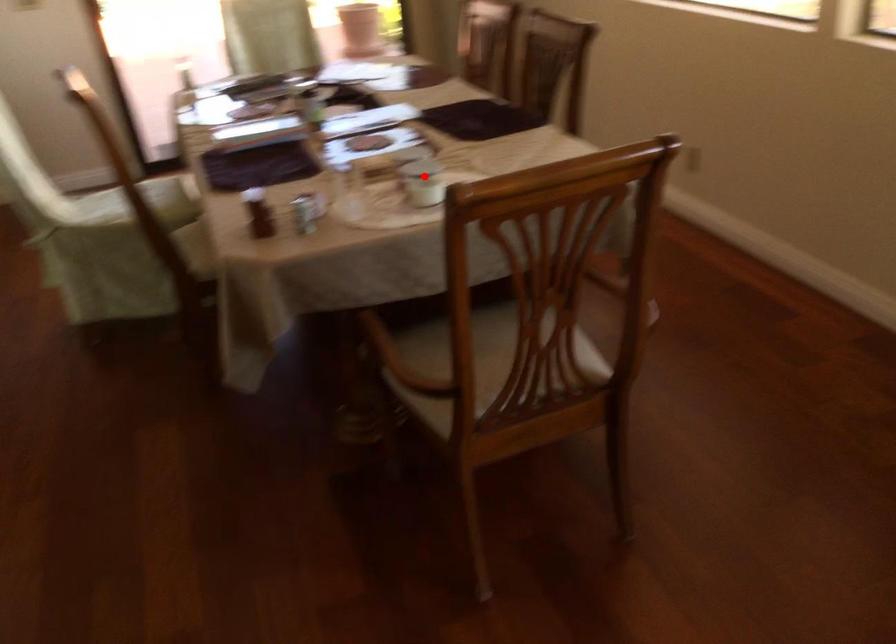
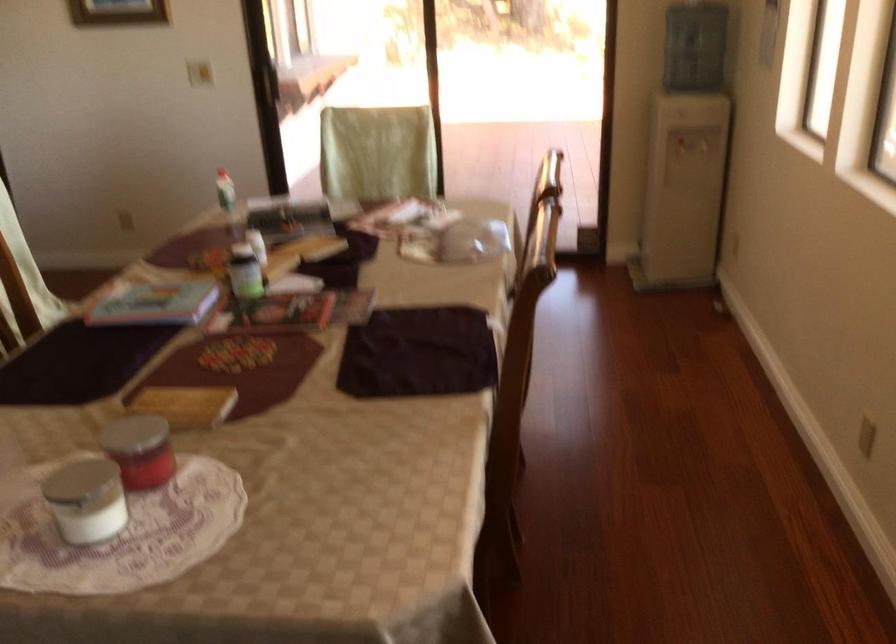
Question: I am providing you with two images of the same scene from different viewpoints. Image1 has a red point marked. In image2, the corresponding 3D location appears at what relative position? Reply with the corresponding letter.

Choices:
 (A) Closer
 (B) Farther

Answer: (A)